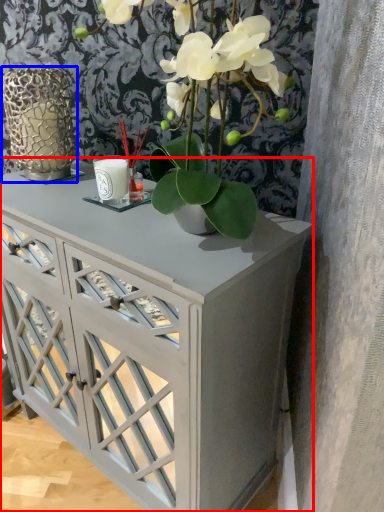
Question: Which of the following is the closest to the observer, table (highlighted by a red box) or glass vase (highlighted by a blue box)?

Choices:
 (A) table
 (B) glass vase

Answer: (A)